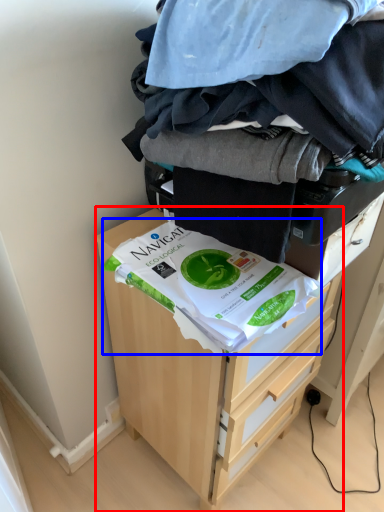
Question: Among these objects, which one is farthest to the camera, chest of drawers (highlighted by a red box) or food (highlighted by a blue box)?

Choices:
 (A) chest of drawers
 (B) food

Answer: (A)